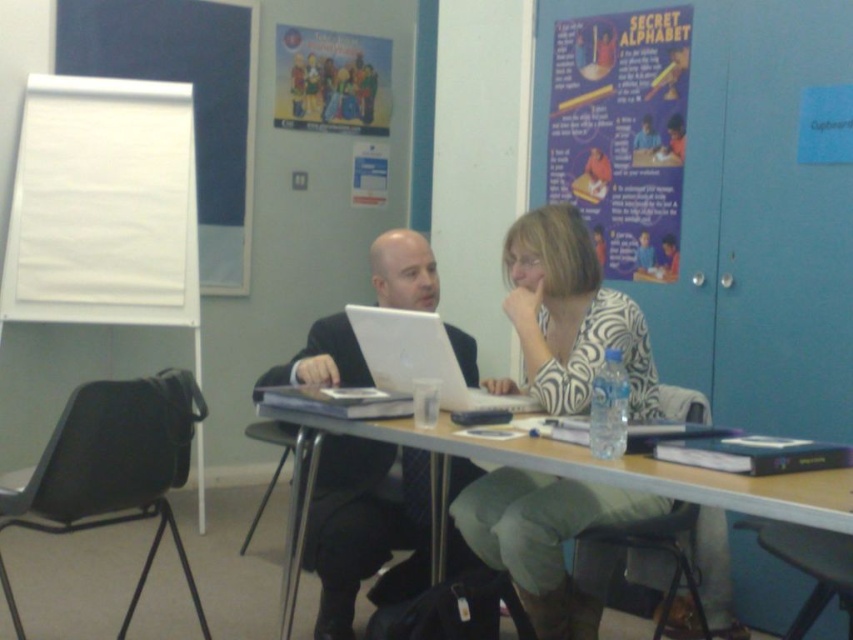
Question: Which object is the farthest from the matte paper poster at upper right?

Choices:
 (A) wooden table at center
 (B) zebra print blouse at center

Answer: (A)

Question: Which object appears closest to the camera in this image?

Choices:
 (A) zebra print blouse at center
 (B) matte black suit at center
 (C) matte paper poster at upper center

Answer: (A)

Question: Which of these objects is positioned farthest from the wooden table at center?

Choices:
 (A) matte paper poster at upper center
 (B) matte black suit at center

Answer: (A)

Question: Is matte paper poster at upper right smaller than matte paper poster at upper center?

Choices:
 (A) yes
 (B) no

Answer: (B)

Question: Does matte paper poster at upper right appear on the left side of wooden table at center?

Choices:
 (A) no
 (B) yes

Answer: (A)

Question: From the image, what is the correct spatial relationship of zebra print blouse at center in relation to matte paper poster at upper center?

Choices:
 (A) right
 (B) left

Answer: (A)